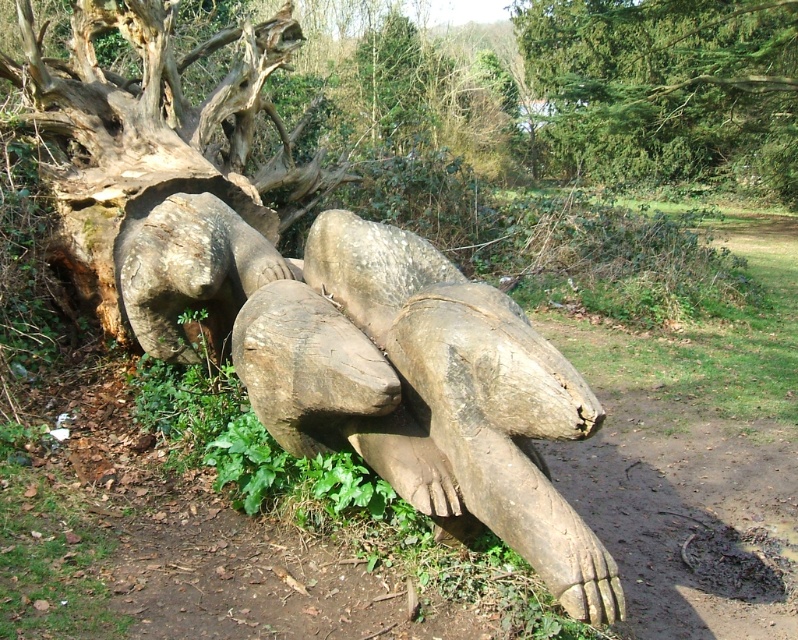
Question: Does natural wood sculpture at center lie behind green textured tree at upper center?

Choices:
 (A) no
 (B) yes

Answer: (A)

Question: Which of the following is the closest to the observer?

Choices:
 (A) green textured tree at upper center
 (B) rough bark tree trunk at center

Answer: (B)

Question: Among these objects, which one is farthest from the camera?

Choices:
 (A) rough bark tree trunk at center
 (B) natural wood sculpture at center
 (C) green textured tree at upper center

Answer: (C)

Question: Can you confirm if green textured tree at upper center is thinner than rough bark tree trunk at center?

Choices:
 (A) no
 (B) yes

Answer: (A)

Question: Is green textured tree at upper center bigger than rough bark tree trunk at center?

Choices:
 (A) no
 (B) yes

Answer: (B)

Question: Which object is farther from the camera taking this photo?

Choices:
 (A) green textured tree at upper center
 (B) natural wood sculpture at center

Answer: (A)